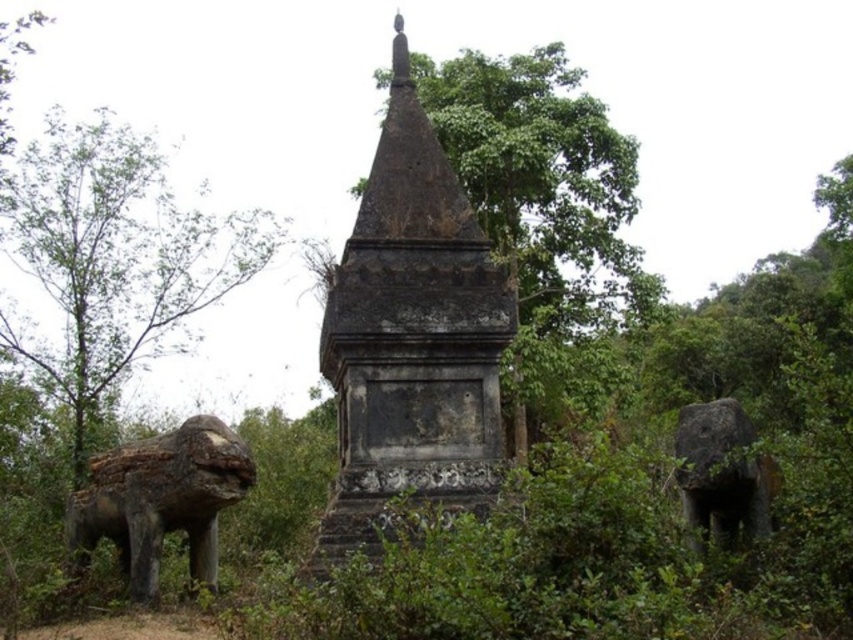
Question: Is the position of dark gray stone stupa at center less distant than that of green leafy tree at left?

Choices:
 (A) no
 (B) yes

Answer: (B)

Question: Which point is closer to the camera?

Choices:
 (A) green leafy tree at left
 (B) dark gray stone stupa at center

Answer: (B)

Question: Which is farther from the dark gray stone stupa at center?

Choices:
 (A) green leafy tree at center
 (B) green leafy tree at left

Answer: (B)

Question: Which object is the farthest from the dark gray stone stupa at center?

Choices:
 (A) green leafy tree at left
 (B) green leafy tree at center

Answer: (A)

Question: Can you confirm if dark gray stone stupa at center is thinner than green leafy tree at left?

Choices:
 (A) yes
 (B) no

Answer: (A)

Question: Can you confirm if green leafy tree at left is positioned below green leafy tree at center?

Choices:
 (A) yes
 (B) no

Answer: (A)